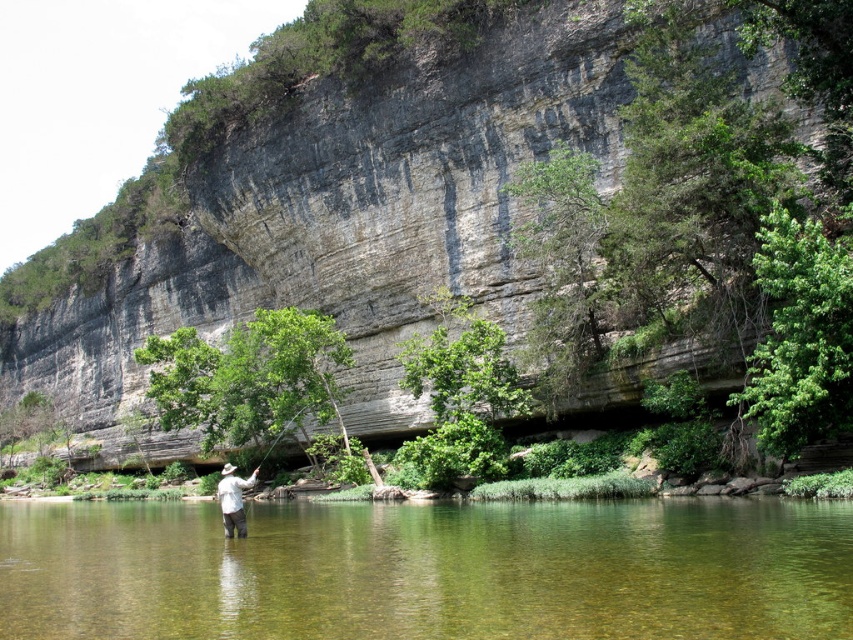
You are standing at the point labeled point (750, 90) and want to walk to the point labeled point (218, 497). Which direction should you move relative to the cliff face?

You should move towards the cliff face because point (750, 90) is closer to the camera than point (218, 497), meaning the latter is further away from you and behind the cliff.